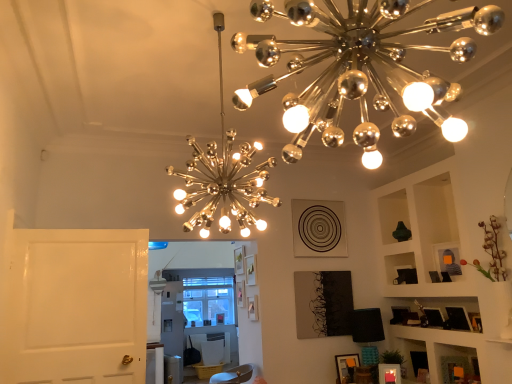
Question: Is metallic silver chandelier at upper center, positioned as the 3th lamp in right-to-left order, shorter than wooden picture frame at lower right, the 1th picture frame in the right-to-left sequence?

Choices:
 (A) no
 (B) yes

Answer: (A)

Question: Is metallic silver chandelier at upper center, which appears as the second lamp when ordered from the bottom, smaller than wooden picture frame at lower right, placed as the 2th picture frame when sorted from back to front?

Choices:
 (A) no
 (B) yes

Answer: (A)

Question: Is metallic silver chandelier at upper center, the second lamp when ordered from back to front, to the right of wooden picture frame at lower right, marked as the first picture frame in a bottom-to-top arrangement, from the viewer's perspective?

Choices:
 (A) no
 (B) yes

Answer: (A)

Question: Can you confirm if metallic silver chandelier at upper center, the second lamp when ordered from back to front, is positioned to the left of wooden picture frame at lower right, marked as the first picture frame in a bottom-to-top arrangement?

Choices:
 (A) yes
 (B) no

Answer: (A)

Question: Is metallic silver chandelier at upper center, positioned as the 2th lamp in front-to-back order, taller than wooden picture frame at lower right, marked as the first picture frame in a bottom-to-top arrangement?

Choices:
 (A) yes
 (B) no

Answer: (A)

Question: Would you say metallic silver chandelier at upper center, positioned as the 2th lamp in front-to-back order, is inside or outside metallic chandelier at upper center, the first lamp when ordered from top to bottom?

Choices:
 (A) inside
 (B) outside

Answer: (B)

Question: Considering the positions of point (195, 144) and point (450, 26), is point (195, 144) closer or farther from the camera than point (450, 26)?

Choices:
 (A) farther
 (B) closer

Answer: (A)

Question: Looking at the image, does metallic silver chandelier at upper center, the second lamp when ordered from back to front, seem bigger or smaller compared to metallic chandelier at upper center, acting as the third lamp starting from the back?

Choices:
 (A) small
 (B) big

Answer: (B)

Question: From their relative heights in the image, would you say metallic silver chandelier at upper center, which appears as the second lamp when ordered from the bottom, is taller or shorter than metallic chandelier at upper center, acting as the third lamp starting from the back?

Choices:
 (A) short
 (B) tall

Answer: (B)

Question: Based on their sizes in the image, would you say metallic silver chandelier at upper center, which is the first lamp in left-to-right order, is bigger or smaller than wooden picture frame at lower right, the second picture frame viewed from the left?

Choices:
 (A) big
 (B) small

Answer: (A)

Question: Looking at their shapes, would you say metallic silver chandelier at upper center, positioned as the 3th lamp in right-to-left order, is wider or thinner than wooden picture frame at lower right, acting as the first picture frame starting from the front?

Choices:
 (A) wide
 (B) thin

Answer: (A)

Question: Do you think metallic silver chandelier at upper center, which is the first lamp in left-to-right order, is within wooden picture frame at lower right, placed as the 2th picture frame when sorted from back to front, or outside of it?

Choices:
 (A) inside
 (B) outside

Answer: (B)

Question: Relative to wooden picture frame at lower right, the 1th picture frame in the right-to-left sequence, is metallic silver chandelier at upper center, positioned as the 2th lamp in front-to-back order, in front or behind?

Choices:
 (A) behind
 (B) front

Answer: (B)

Question: Relative to white glossy door at left, is metallic chandelier at upper center, which appears as the first lamp when viewed from the front, in front or behind?

Choices:
 (A) behind
 (B) front

Answer: (B)

Question: From the image's perspective, is metallic chandelier at upper center, which is the second lamp in left-to-right order, above or below white glossy door at left?

Choices:
 (A) below
 (B) above

Answer: (B)